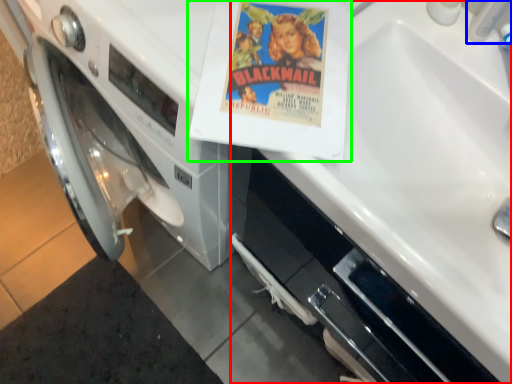
Question: Estimate the real-world distances between objects in this image. Which object is farther from sink (highlighted by a red box), faucet (highlighted by a blue box) or paperback book (highlighted by a green box)?

Choices:
 (A) faucet
 (B) paperback book

Answer: (A)